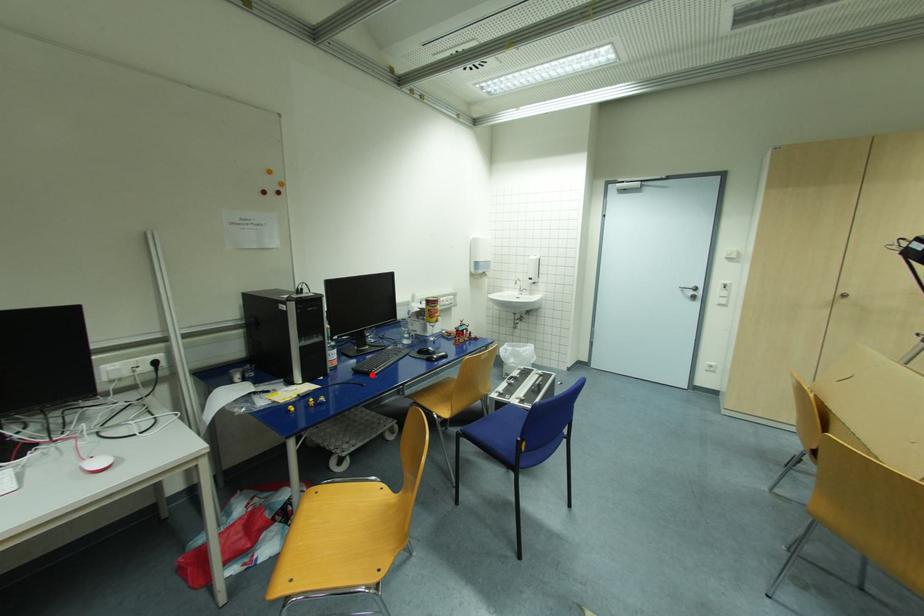
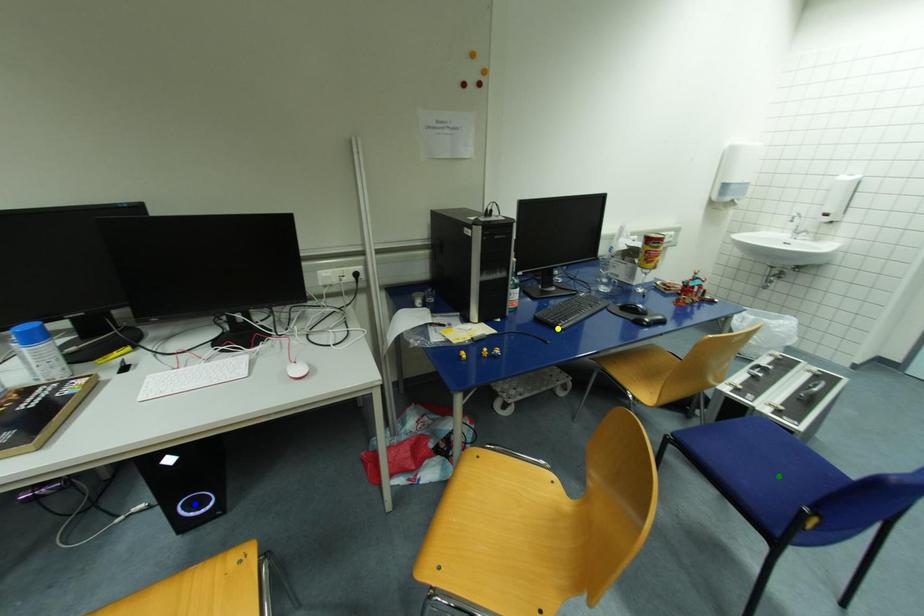
Question: I am providing you with two images of the same scene from different viewpoints. A red point is marked on the first image. You are given multiple points on the second image. Which mark in image 2 goes with the point in image 1?

Choices:
 (A) blue point
 (B) yellow point
 (C) green point

Answer: (B)